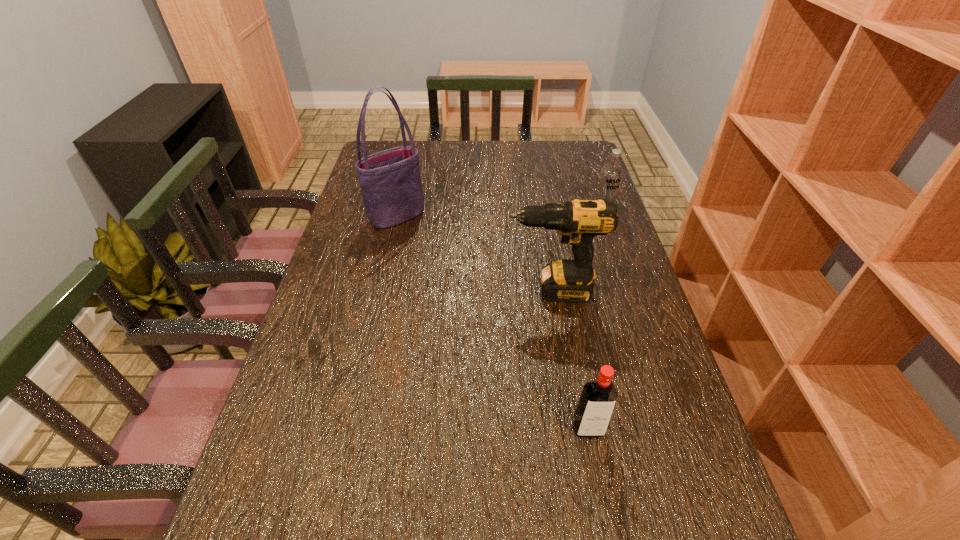
Identify the location of vacant area that lies between the tallest object and the drill. (474, 253).

Identify the location of object that is the closest to the tallest object. Image resolution: width=960 pixels, height=540 pixels. [x=569, y=280].

Identify which object is the nearest to the nearest object. Please provide its 2D coordinates. Your answer should be formatted as a tuple, i.e. [(x, y)], where the tuple contains the x and y coordinates of a point satisfying the conditions above.

[(569, 280)]